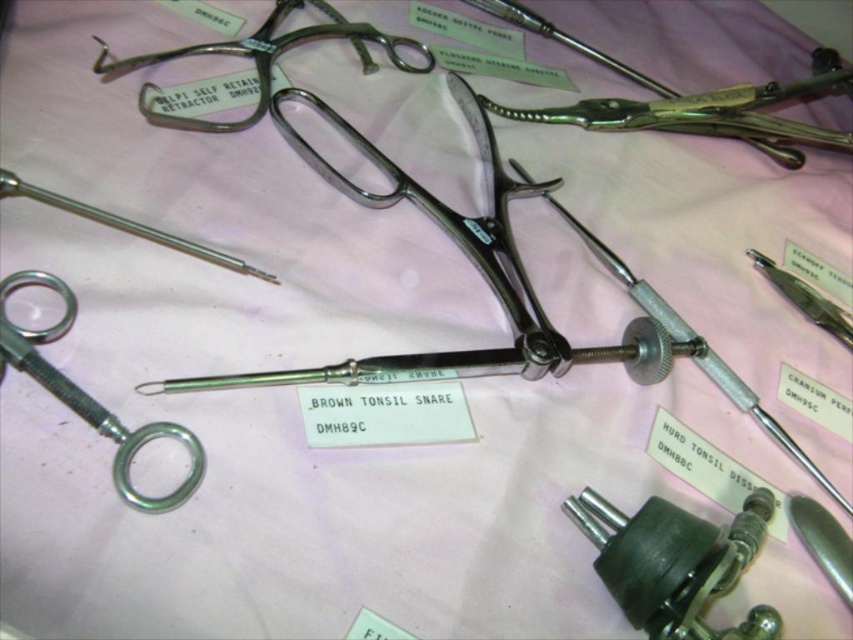
You are a surgeon preparing for a tonsillectomy and need to quickly grab the metallic silver screw at lower right and the satin silver scalpel at upper right. Given that your reach is limited to 24 inches, can you comfortably reach both items without moving your position?

The distance between the metallic silver screw at lower right and the satin silver scalpel at upper right is 25.95 inches, which exceeds your 24 inch reach limit. You would need to adjust your position to comfortably access both items.

You are a medical student observing the surgical tools arranged on the cloth. You notice the metallic silver screw at lower right and the satin silver scalpel at upper right. Which of these two objects is shorter in height?

The metallic silver screw at lower right has a lesser height compared to the satin silver scalpel at upper right, so the metallic silver screw at lower right is shorter in height.